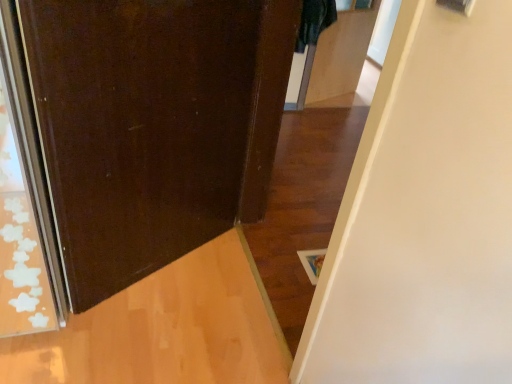
Question: In the image, is matte brown door at left, placed as the 1th door when sorted from left to right, on the left side or the right side of matte brown door at center, the 2th door when ordered from left to right?

Choices:
 (A) right
 (B) left

Answer: (B)

Question: From the image's perspective, is matte brown door at left, the second door when ordered from right to left, positioned above or below matte brown door at center, the first door positioned from the right?

Choices:
 (A) above
 (B) below

Answer: (B)

Question: Considering the positions of matte brown door at left, placed as the 1th door when sorted from left to right, and matte brown door at center, the 2th door when ordered from left to right, in the image, is matte brown door at left, placed as the 1th door when sorted from left to right, wider or thinner than matte brown door at center, the 2th door when ordered from left to right,?

Choices:
 (A) thin
 (B) wide

Answer: (A)

Question: Is matte brown door at center, the 2th door when ordered from left to right, situated inside matte brown door at left, placed as the 1th door when sorted from left to right, or outside?

Choices:
 (A) inside
 (B) outside

Answer: (B)

Question: From the image's perspective, is matte brown door at center, the 2th door when ordered from left to right, located above or below matte brown door at left, placed as the 1th door when sorted from left to right?

Choices:
 (A) below
 (B) above

Answer: (B)

Question: Relative to matte brown door at left, the second door when ordered from right to left, is matte brown door at center, the 2th door when ordered from left to right, in front or behind?

Choices:
 (A) behind
 (B) front

Answer: (B)

Question: Considering the positions of point (348, 233) and point (180, 59), is point (348, 233) closer or farther from the camera than point (180, 59)?

Choices:
 (A) closer
 (B) farther

Answer: (A)